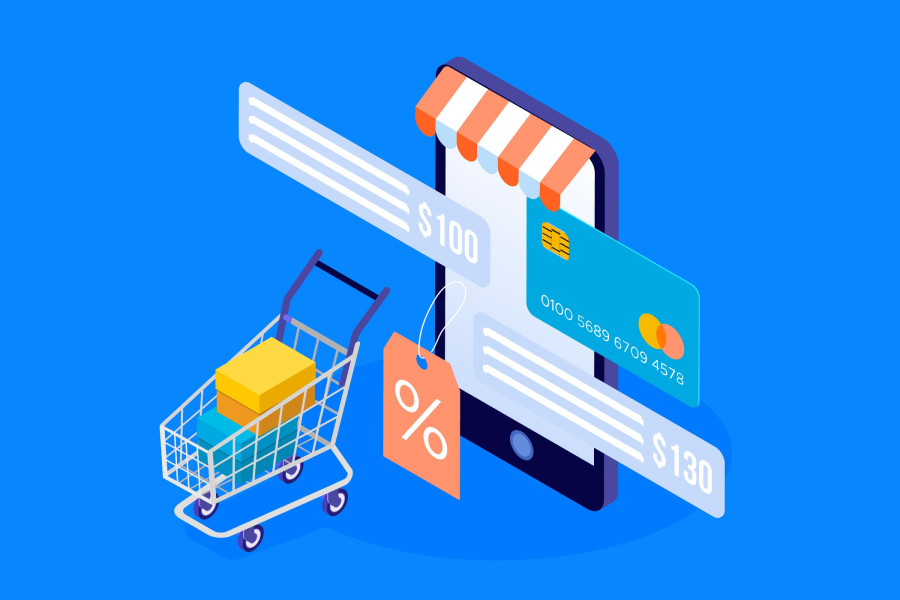
You are a GUI agent. You are given a task and a screenshot of the screen. Output one action in this format:
    pyautogui.click(x=<x>, y=<y>)
    Task: Click on the handle
    The height and width of the screenshot is (600, 900).
    Given the screenshot: What is the action you would take?
    pyautogui.click(x=347, y=281)